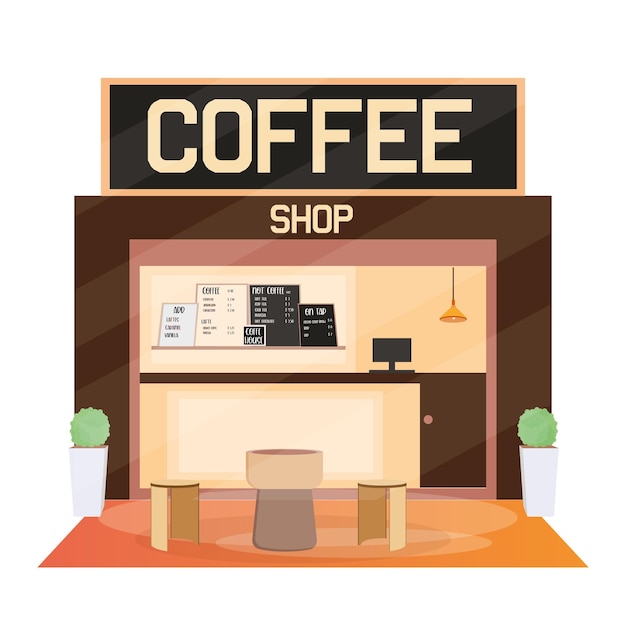
Where is `table`? This screenshot has height=626, width=626. table is located at coordinates (292, 478).